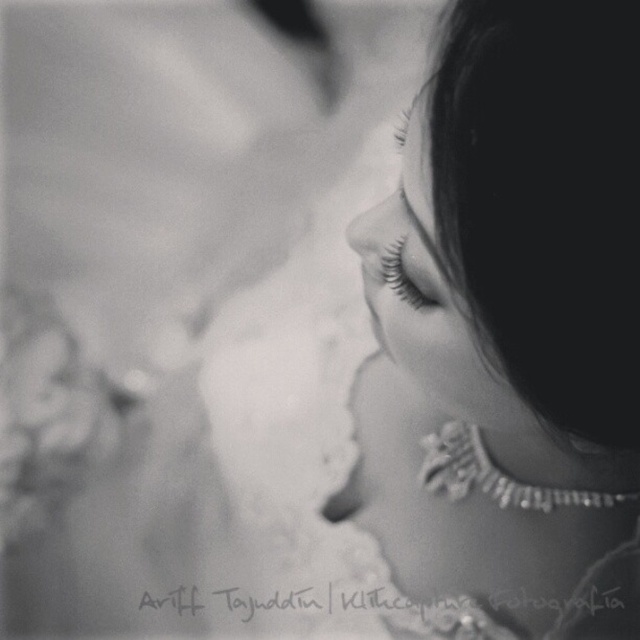
Question: Considering the relative positions of pearl necklace at upper right and smooth skin at upper right in the image provided, where is pearl necklace at upper right located with respect to smooth skin at upper right?

Choices:
 (A) below
 (B) above

Answer: (A)

Question: Is smooth skin at upper right below black eyelashes at center?

Choices:
 (A) no
 (B) yes

Answer: (A)

Question: Which of these objects is positioned farthest from the black eyelashes at center?

Choices:
 (A) pearl necklace at upper right
 (B) smooth skin at upper right

Answer: (A)

Question: Estimate the real-world distances between objects in this image. Which object is closer to the black eyelashes at center?

Choices:
 (A) pearl necklace at upper right
 (B) smooth skin at upper right

Answer: (B)

Question: Which object appears closest to the camera in this image?

Choices:
 (A) black eyelashes at center
 (B) smooth skin at upper right

Answer: (B)

Question: Does smooth skin at upper right have a smaller size compared to black eyelashes at center?

Choices:
 (A) no
 (B) yes

Answer: (A)